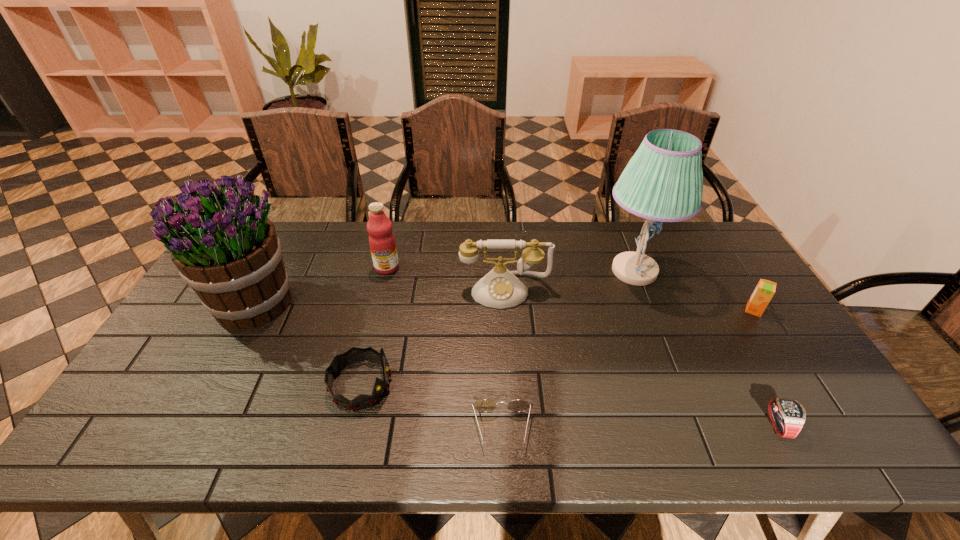
Image resolution: width=960 pixels, height=540 pixels. In order to click on object present at the left edge in this screenshot , I will do `click(226, 249)`.

Identify the location of orange juice that is at the right edge. (765, 289).

Image resolution: width=960 pixels, height=540 pixels. I want to click on watch that is at the right edge, so point(787,416).

At what (x,y) coordinates should I click in order to perform the action: click on object that is at the near right corner. Please return your answer as a coordinate pair (x, y). Looking at the image, I should click on (787, 416).

The image size is (960, 540). I want to click on free location at the far edge, so click(536, 224).

Where is `blank area at the near edge`? blank area at the near edge is located at coordinates (564, 451).

Identify the location of free location at the left edge. This screenshot has width=960, height=540. (182, 381).

Locate an element on the screen. The height and width of the screenshot is (540, 960). vacant space at the right edge of the desktop is located at coordinates (785, 331).

Locate an element on the screen. This screenshot has height=540, width=960. vacant space at the far left corner is located at coordinates (276, 233).

Locate an element on the screen. vacant space in between the tiara and the leftmost object is located at coordinates (306, 343).